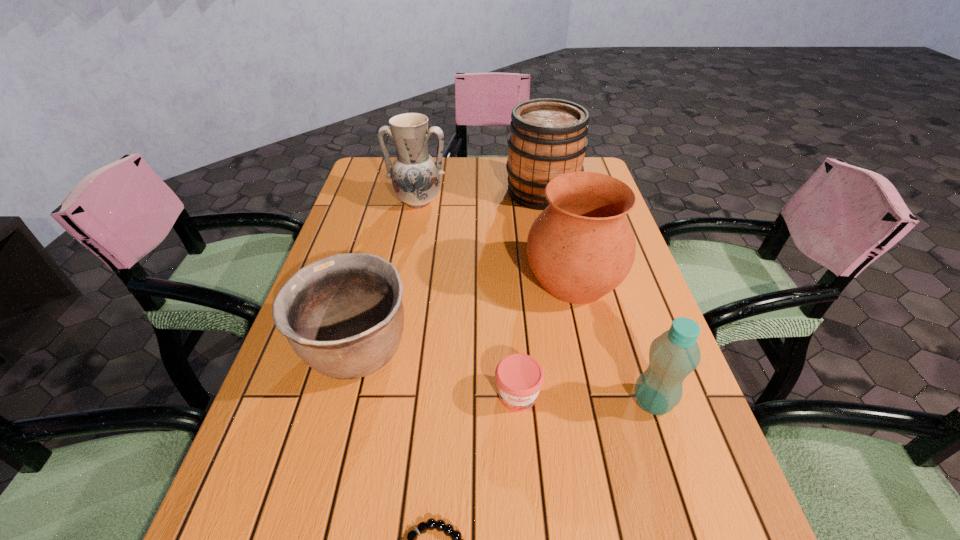
Locate an element on the screen. This screenshot has width=960, height=540. object that stands as the sixth closest to the farthest pottery is located at coordinates (431, 524).

Identify which object is the fifth closest to the shortest pottery. Please provide its 2D coordinates. Your answer should be formatted as a tuple, i.e. [(x, y)], where the tuple contains the x and y coordinates of a point satisfying the conditions above.

[(673, 355)]

At what (x,y) coordinates should I click in order to perform the action: click on the second closest pottery to the farthest pottery. Please return your answer as a coordinate pair (x, y). Image resolution: width=960 pixels, height=540 pixels. Looking at the image, I should click on (343, 315).

Select which pottery is the second closest to the sixth tallest object. Please provide its 2D coordinates. Your answer should be formatted as a tuple, i.e. [(x, y)], where the tuple contains the x and y coordinates of a point satisfying the conditions above.

[(343, 315)]